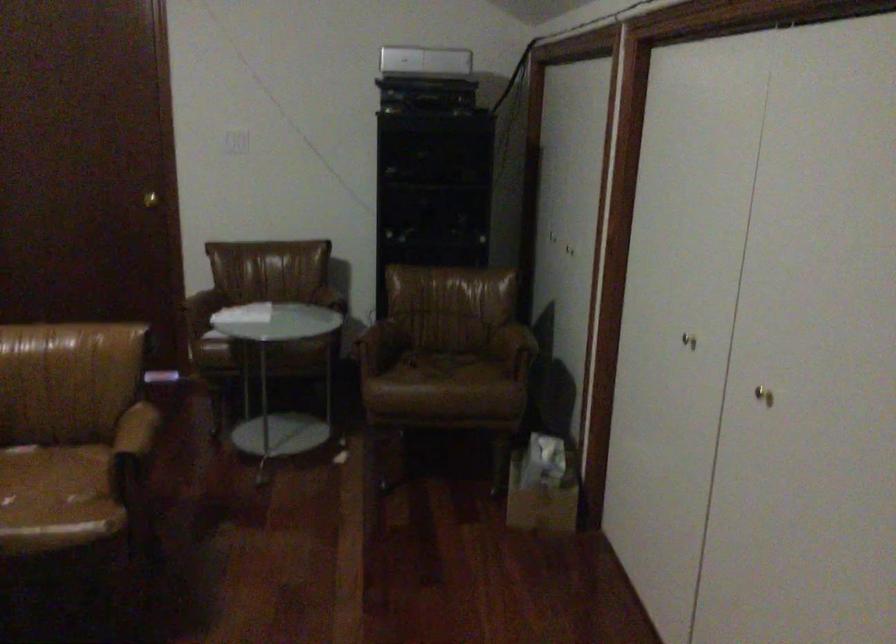
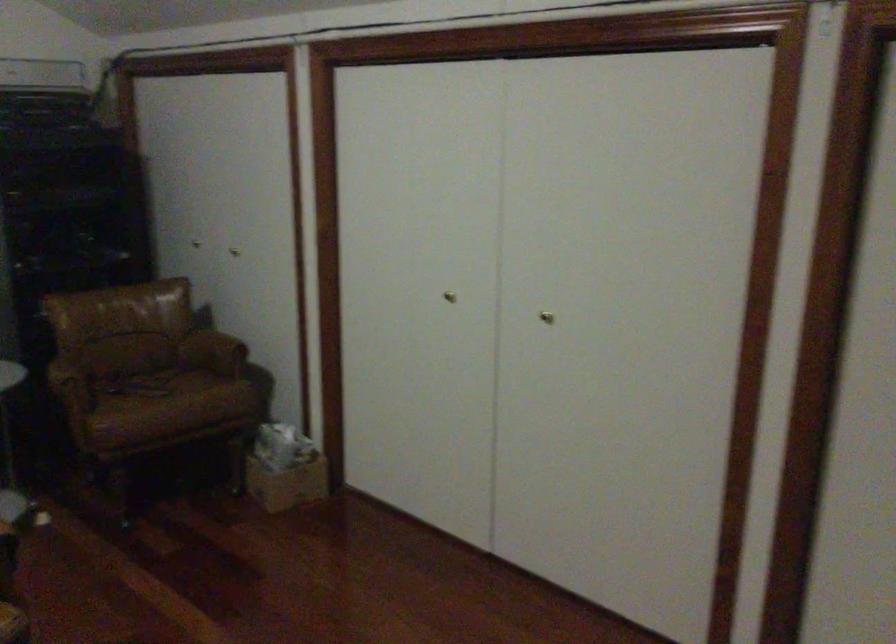
Locate, in the second image, the point that corresponds to (455,355) in the first image.

(149, 370)